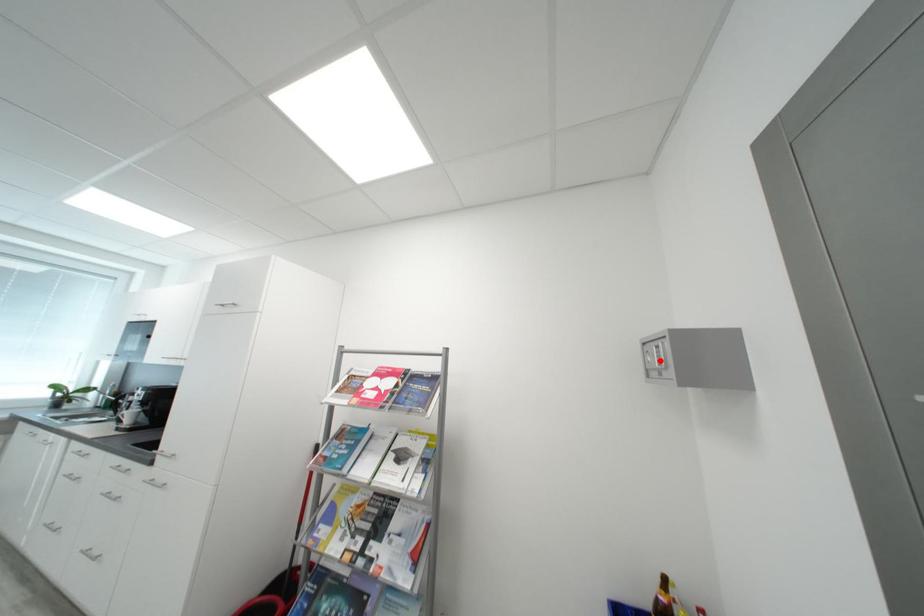
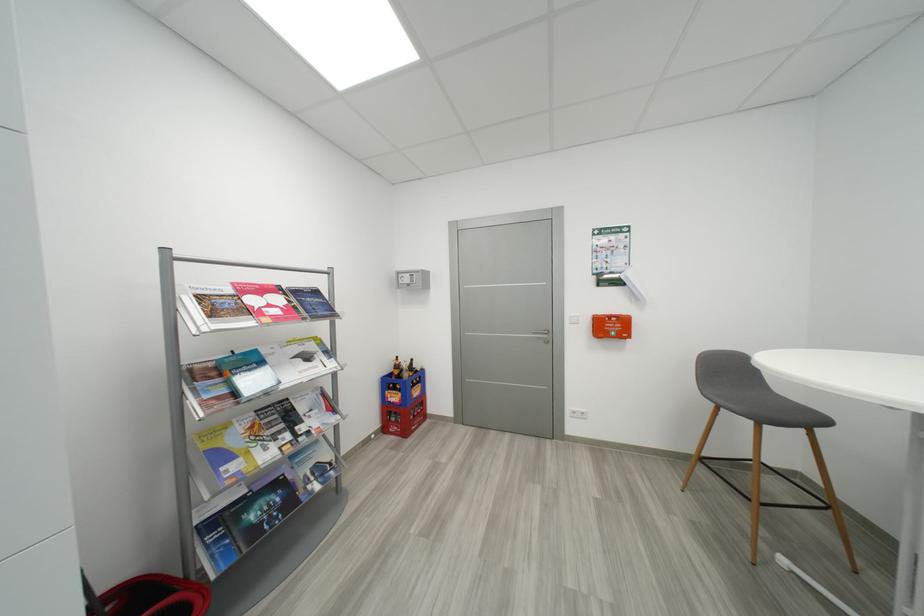
Locate, in the second image, the point that corresponds to the highlighted location in the first image.

(412, 282)